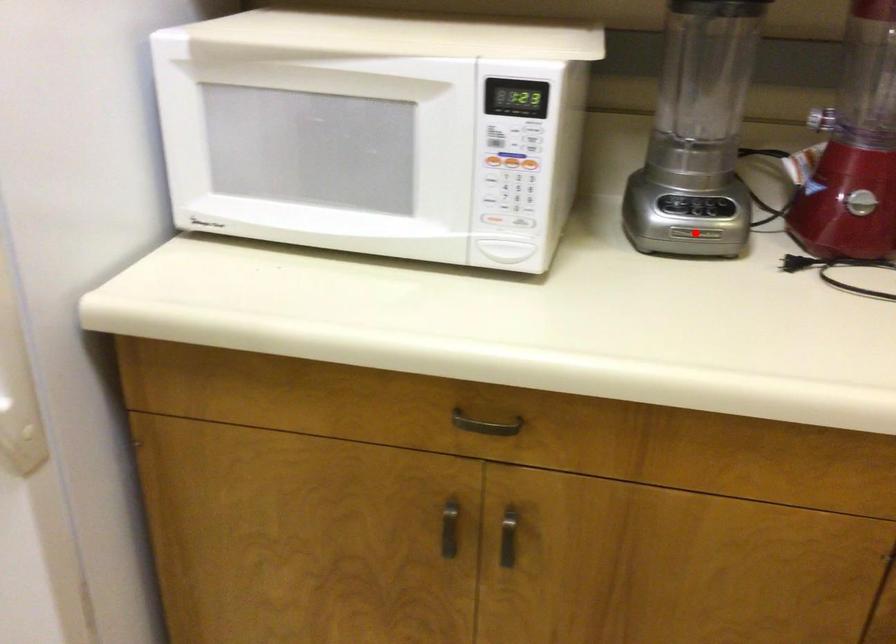
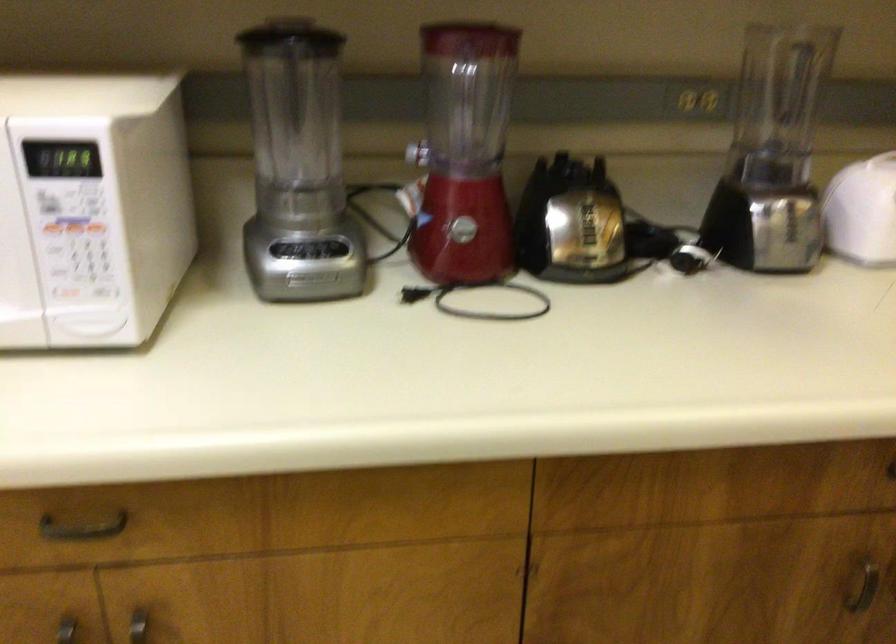
Locate, in the second image, the point that corresponds to the highlighted location in the first image.

(309, 278)